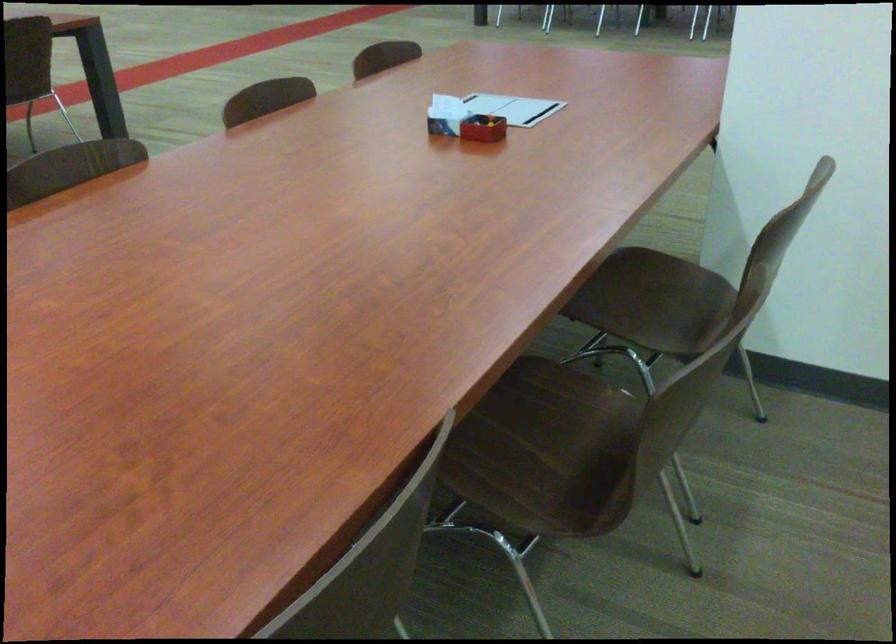
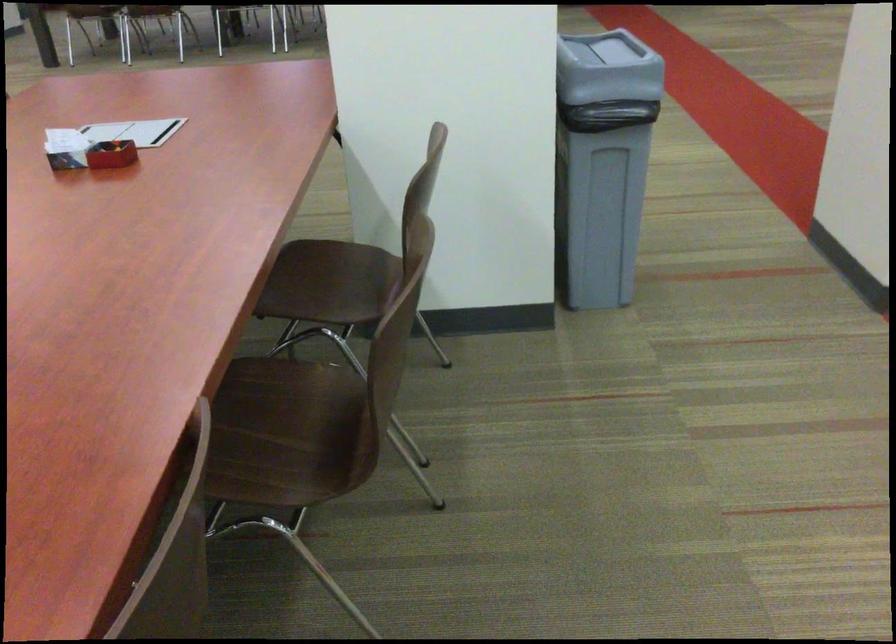
Which direction would the cameraman need to move to produce the second image?

The cameraman moved toward left, backward.